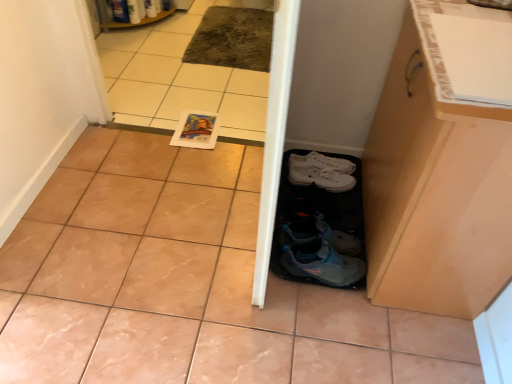
The width and height of the screenshot is (512, 384). In order to click on vacant space in front of white matte door at center in this screenshot , I will do `click(248, 319)`.